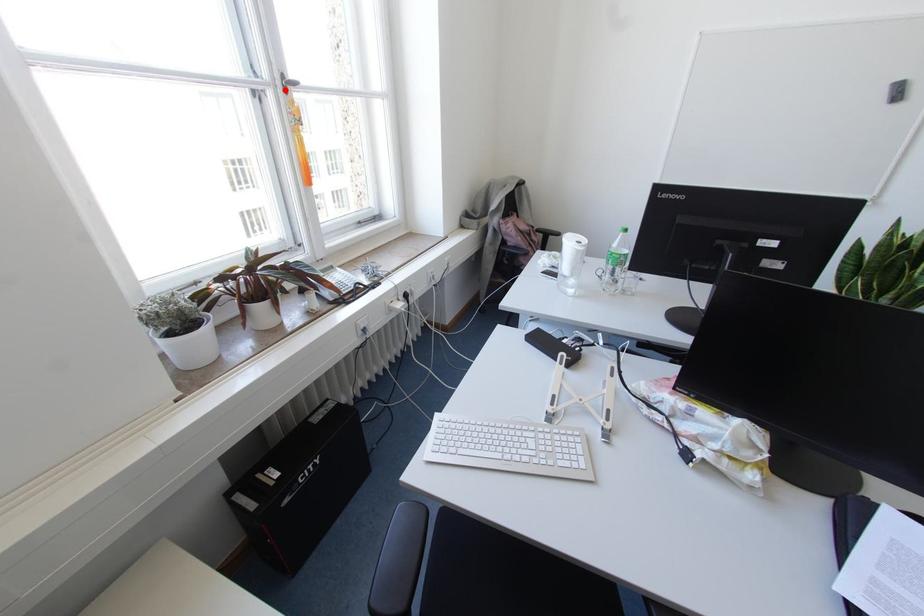
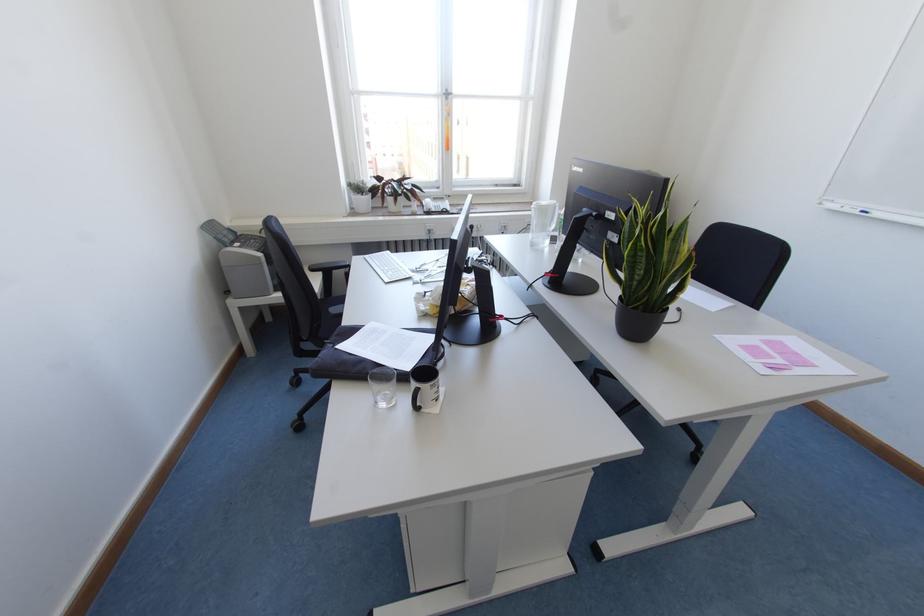
The point at the highlighted location is marked in the first image. Where is the corresponding point in the second image?

(446, 98)